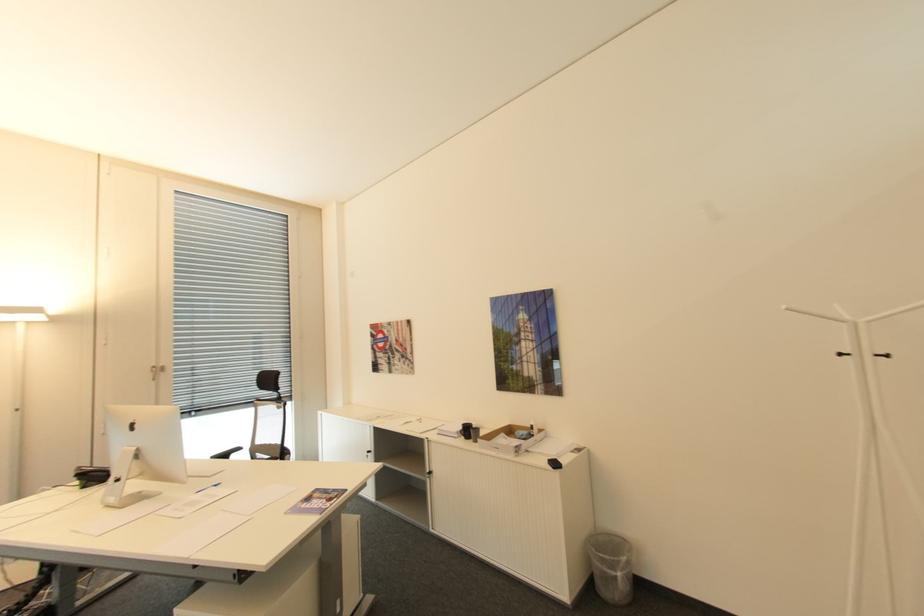
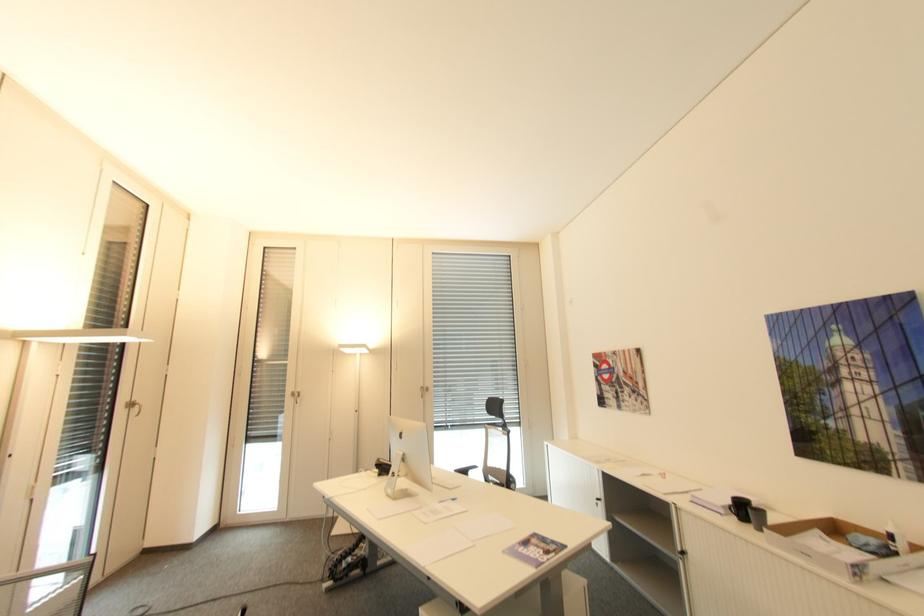
Where in the second image is the point corresponding to (289,513) from the first image?

(507, 553)